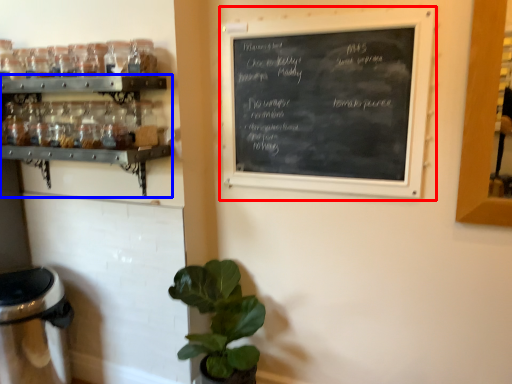
Question: Which object is further to the camera taking this photo, bulletin board (highlighted by a red box) or shelf (highlighted by a blue box)?

Choices:
 (A) bulletin board
 (B) shelf

Answer: (B)